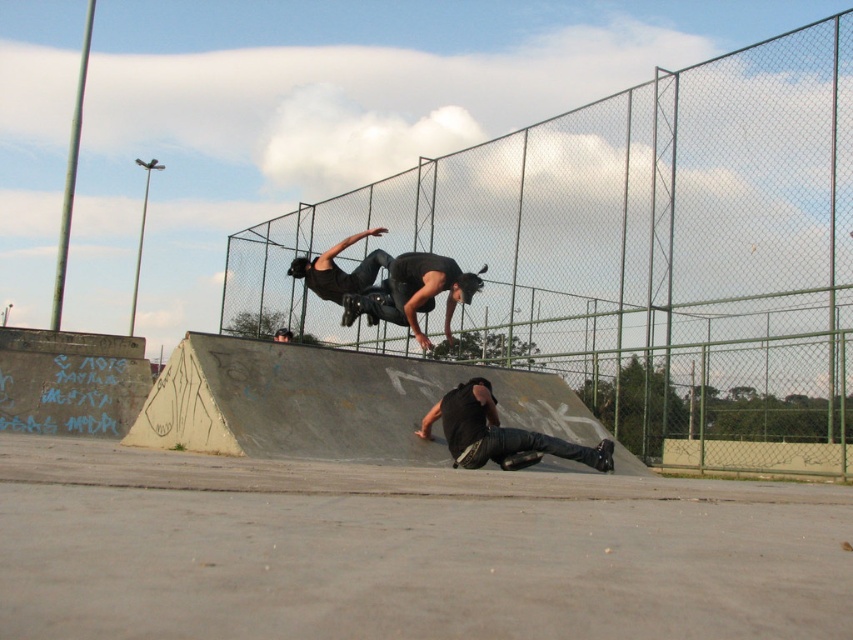
Which is behind, point (396, 218) or point (355, 296)?

The point (396, 218) is more distant.

Can you confirm if green chain-link fence at upper center is positioned to the right of black rubber skateboard at center?

Yes, green chain-link fence at upper center is to the right of black rubber skateboard at center.

Between point (408, 188) and point (366, 310), which one is positioned in front?

Point (366, 310)

Find the location of a particular element. The width and height of the screenshot is (853, 640). green chain-link fence at upper center is located at coordinates (639, 253).

Does point (474, 285) lie in front of point (390, 300)?

Yes, point (474, 285) is closer to viewer.

This screenshot has width=853, height=640. I want to click on black matte skateboarder at center, so click(392, 284).

Is green chain-link fence at upper center closer to the viewer compared to black matte pants at lower center?

That is False.

Find the location of a particular element. green chain-link fence at upper center is located at coordinates (639, 253).

Find the location of `green chain-link fence at upper center`. green chain-link fence at upper center is located at coordinates (639, 253).